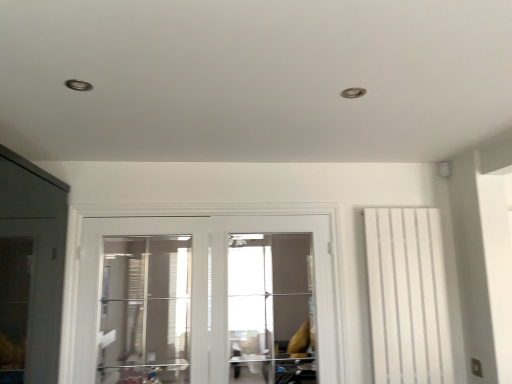
This screenshot has width=512, height=384. What do you see at coordinates (145, 310) in the screenshot?
I see `transparent glass door at center` at bounding box center [145, 310].

Where is `transparent glass door at center`? The image size is (512, 384). transparent glass door at center is located at coordinates (145, 310).

Which of these two, transparent glass door at center or white matte radiator at right, is wider?

white matte radiator at right is wider.

In terms of size, does transparent glass door at center appear bigger or smaller than white matte radiator at right?

Considering their sizes, transparent glass door at center takes up more space than white matte radiator at right.

Is transparent glass screen door at center not near white glossy door at center?

That's right, there is a large distance between transparent glass screen door at center and white glossy door at center.

At what (x,y) coordinates should I click in order to perform the action: click on screen door on the right of white glossy door at center. Please return your answer as a coordinate pair (x, y). The image size is (512, 384). Looking at the image, I should click on (269, 297).

Considering the positions of objects transparent glass screen door at center and white glossy door at center in the image provided, who is more to the left, transparent glass screen door at center or white glossy door at center?

From the viewer's perspective, white glossy door at center appears more on the left side.

Can you confirm if transparent glass screen door at center is wider than white glossy door at center?

No, transparent glass screen door at center is not wider than white glossy door at center.

Find the location of a particular element. This screenshot has height=384, width=512. curtain above the transparent glass screen door at center (from the image's perspective) is located at coordinates (407, 296).

Is white matte radiator at right turned away from transparent glass screen door at center?

No, white matte radiator at right is not facing away from transparent glass screen door at center.

Who is shorter, white matte radiator at right or transparent glass screen door at center?

Standing shorter between the two is transparent glass screen door at center.

Who is bigger, white matte radiator at right or transparent glass screen door at center?

transparent glass screen door at center.

Can you tell me how much transparent glass screen door at center and transparent glass door at center differ in facing direction?

transparent glass screen door at center and transparent glass door at center are facing 0.00125 degrees away from each other.

From the image's perspective, is transparent glass screen door at center above or below transparent glass door at center?

Based on their image positions, transparent glass screen door at center is located beneath transparent glass door at center.

Could you tell me if transparent glass screen door at center is turned towards transparent glass door at center?

No.

Is white matte radiator at right looking in the opposite direction of white glossy door at center?

No, white matte radiator at right's orientation is not away from white glossy door at center.

Is white matte radiator at right surrounding white glossy door at center?

No.

Is white matte radiator at right beside white glossy door at center?

white matte radiator at right and white glossy door at center are not in contact.

Considering the relative sizes of white matte radiator at right and white glossy door at center in the image provided, is white matte radiator at right taller than white glossy door at center?

In fact, white matte radiator at right may be shorter than white glossy door at center.

From the image's perspective, is transparent glass door at center located above transparent glass screen door at center?

Yes.

Is transparent glass door at center outside of transparent glass screen door at center?

transparent glass door at center is positioned outside transparent glass screen door at center.

Is point (144, 337) positioned in front of point (288, 326)?

Yes, point (144, 337) is closer to viewer.

Is transparent glass door at center taller or shorter than transparent glass screen door at center?

In the image, transparent glass door at center appears to be shorter than transparent glass screen door at center.

How much distance is there between transparent glass screen door at center and white matte radiator at right?

The distance of transparent glass screen door at center from white matte radiator at right is 3.28 meters.

From a real-world perspective, is transparent glass screen door at center over white matte radiator at right?

Incorrect, from a real-world perspective, transparent glass screen door at center is lower than white matte radiator at right.

What's the angular difference between transparent glass screen door at center and white matte radiator at right's facing directions?

The angular difference between transparent glass screen door at center and white matte radiator at right is 0.000697 degrees.

Considering the relative positions of transparent glass screen door at center and white matte radiator at right in the image provided, is transparent glass screen door at center to the right of white matte radiator at right from the viewer's perspective?

Incorrect, transparent glass screen door at center is not on the right side of white matte radiator at right.

In order to click on curtain above the transparent glass door at center (from the image's perspective) in this screenshot , I will do point(407,296).

Locate an element on the screen. The height and width of the screenshot is (384, 512). door on the left of transparent glass screen door at center is located at coordinates (204, 285).

In the scene shown: Estimate the real-world distances between objects in this image. Which object is closer to white glossy door at center, transparent glass screen door at center or white matte radiator at right?

white matte radiator at right.

Which object lies nearer to the anchor point white glossy door at center, white matte radiator at right or transparent glass screen door at center?

Among the two, white matte radiator at right is located nearer to white glossy door at center.

Consider the image. When comparing their distances from white glossy door at center, does transparent glass door at center or transparent glass screen door at center seem closer?

Among the two, transparent glass door at center is located nearer to white glossy door at center.

When comparing their distances from white glossy door at center, does transparent glass screen door at center or transparent glass door at center seem further?

transparent glass screen door at center lies further to white glossy door at center than the other object.

Considering their positions, is transparent glass door at center positioned closer to white matte radiator at right than transparent glass screen door at center?

transparent glass door at center is positioned closer to the anchor white matte radiator at right.

Based on their spatial positions, is transparent glass door at center or white matte radiator at right closer to transparent glass screen door at center?

transparent glass door at center.

Based on their spatial positions, is white glossy door at center or white matte radiator at right closer to transparent glass screen door at center?

The object closer to transparent glass screen door at center is white glossy door at center.

Which object lies further to the anchor point white matte radiator at right, white glossy door at center or transparent glass door at center?

Based on the image, transparent glass door at center appears to be further to white matte radiator at right.

Where is `screen door between white glossy door at center and white matte radiator at right`? The width and height of the screenshot is (512, 384). screen door between white glossy door at center and white matte radiator at right is located at coordinates (269, 297).

Where is `door between transparent glass door at center and transparent glass screen door at center in the horizontal direction`? The image size is (512, 384). door between transparent glass door at center and transparent glass screen door at center in the horizontal direction is located at coordinates (204, 285).

Identify the location of door located between transparent glass door at center and white matte radiator at right in the left-right direction. The width and height of the screenshot is (512, 384). (204, 285).

What are the coordinates of `screen door between transparent glass door at center and white matte radiator at right in the horizontal direction` in the screenshot? It's located at (269, 297).